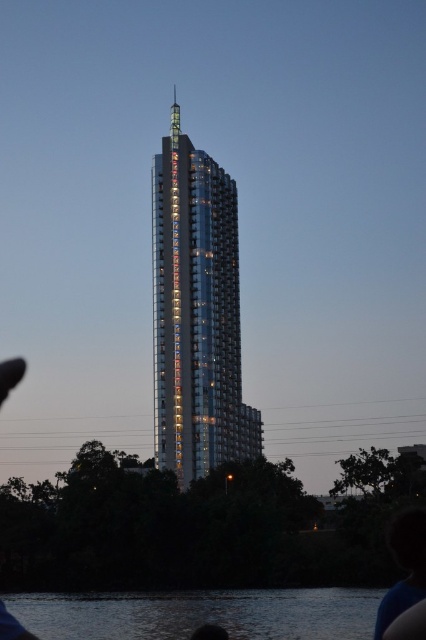
Question: Can you confirm if shiny metallic building at center is wider than dark water at lower center?

Choices:
 (A) yes
 (B) no

Answer: (B)

Question: Is shiny metallic building at center smaller than dark water at lower center?

Choices:
 (A) yes
 (B) no

Answer: (B)

Question: Among these points, which one is farthest from the camera?

Choices:
 (A) (157, 224)
 (B) (313, 632)

Answer: (A)

Question: Which point is closer to the camera taking this photo?

Choices:
 (A) (282, 612)
 (B) (229, 387)

Answer: (A)

Question: Which point is closer to the camera?

Choices:
 (A) dark water at lower center
 (B) shiny metallic building at center

Answer: (A)

Question: Is the position of shiny metallic building at center less distant than that of dark water at lower center?

Choices:
 (A) yes
 (B) no

Answer: (B)